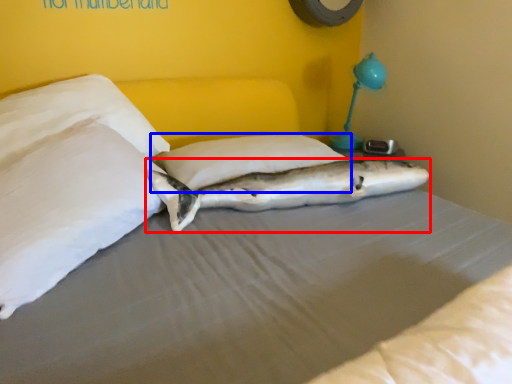
Question: Which object appears farthest to the camera in this image, shark (highlighted by a red box) or pillow (highlighted by a blue box)?

Choices:
 (A) shark
 (B) pillow

Answer: (B)